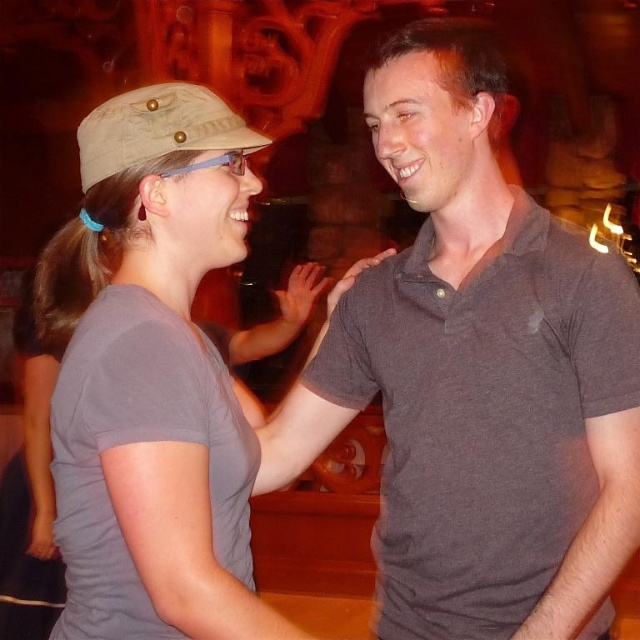
Question: Is gray cotton polo shirt at center wider than matte khaki cap at left?

Choices:
 (A) no
 (B) yes

Answer: (B)

Question: Which point is closer to the camera taking this photo?

Choices:
 (A) (120, 157)
 (B) (452, 244)
 (C) (232, 394)

Answer: (A)

Question: Is gray cotton polo shirt at center positioned at the back of tan canvas baseball hat at left?

Choices:
 (A) yes
 (B) no

Answer: (A)

Question: Is gray cotton polo shirt at center closer to camera compared to tan canvas baseball hat at left?

Choices:
 (A) yes
 (B) no

Answer: (B)

Question: Based on their relative distances, which object is farther from the matte khaki cap at left?

Choices:
 (A) gray cotton polo shirt at center
 (B) tan canvas baseball hat at left

Answer: (A)

Question: Which point is closer to the camera?

Choices:
 (A) tan canvas baseball hat at left
 (B) matte khaki cap at left

Answer: (B)